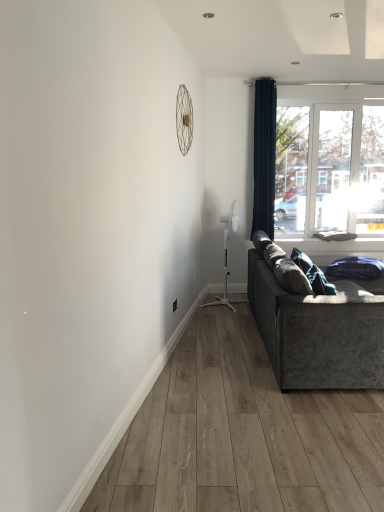
Question: Should I look upward or downward to see velvet blue pillow at lower right?

Choices:
 (A) down
 (B) up

Answer: (A)

Question: Is navy velvet curtain at upper right surrounding white plastic mechanical fan at center-right, arranged as the 2th mechanical fan when viewed from the front?

Choices:
 (A) no
 (B) yes

Answer: (A)

Question: From the image's perspective, is navy velvet curtain at upper right beneath white plastic mechanical fan at center-right, the 1th mechanical fan viewed from the back?

Choices:
 (A) yes
 (B) no

Answer: (B)

Question: Is navy velvet curtain at upper right completely or partially outside of white plastic mechanical fan at center-right, placed as the 1th mechanical fan when sorted from right to left?

Choices:
 (A) no
 (B) yes

Answer: (B)

Question: Can you confirm if navy velvet curtain at upper right is positioned to the left of white plastic mechanical fan at center-right, which is counted as the 2th mechanical fan, starting from the top?

Choices:
 (A) no
 (B) yes

Answer: (A)

Question: Considering the relative sizes of navy velvet curtain at upper right and white plastic mechanical fan at center-right, the second mechanical fan positioned from the left, in the image provided, is navy velvet curtain at upper right shorter than white plastic mechanical fan at center-right, the second mechanical fan positioned from the left,?

Choices:
 (A) no
 (B) yes

Answer: (A)

Question: Does navy velvet curtain at upper right have a lesser width compared to white plastic mechanical fan at center-right, the second mechanical fan positioned from the left?

Choices:
 (A) no
 (B) yes

Answer: (B)

Question: Is transparent glass window at upper right completely or partially outside of metallic wire at upper center, which appears as the 1th mechanical fan when viewed from the front?

Choices:
 (A) no
 (B) yes

Answer: (B)

Question: Does transparent glass window at upper right have a greater height compared to metallic wire at upper center, which appears as the 1th mechanical fan when viewed from the left?

Choices:
 (A) no
 (B) yes

Answer: (B)

Question: Is transparent glass window at upper right positioned with its back to metallic wire at upper center, the first mechanical fan in the top-to-bottom sequence?

Choices:
 (A) yes
 (B) no

Answer: (B)

Question: Does transparent glass window at upper right contain metallic wire at upper center, which is the 2th mechanical fan in right-to-left order?

Choices:
 (A) no
 (B) yes

Answer: (A)

Question: Are transparent glass window at upper right and metallic wire at upper center, the first mechanical fan in the top-to-bottom sequence, located far from each other?

Choices:
 (A) yes
 (B) no

Answer: (A)

Question: From the image's perspective, would you say transparent glass window at upper right is positioned over metallic wire at upper center, which is the 2th mechanical fan in right-to-left order?

Choices:
 (A) yes
 (B) no

Answer: (B)

Question: From a real-world perspective, is transparent glass window at upper right on top of white plastic mechanical fan at center-right, placed as the 1th mechanical fan when sorted from right to left?

Choices:
 (A) yes
 (B) no

Answer: (A)